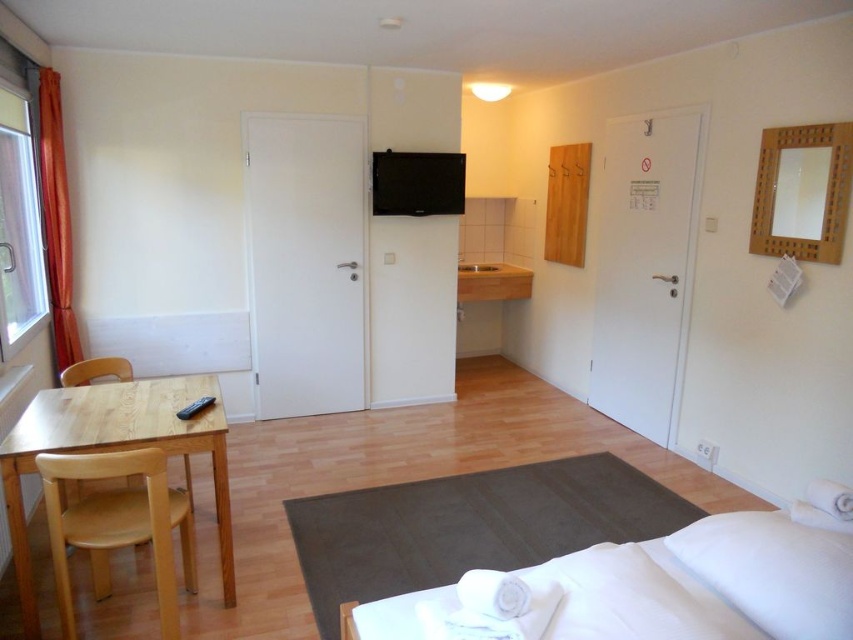
Question: Which point appears closest to the camera in this image?

Choices:
 (A) (213, 461)
 (B) (749, 536)
 (C) (96, 454)
 (D) (482, 84)

Answer: (B)

Question: Considering the real-world distances, which object is closest to the wooden chair at lower left?

Choices:
 (A) white soft pillow at lower right
 (B) light brown wooden table at left
 (C) light brown wooden chair at left

Answer: (B)

Question: Based on their relative distances, which object is nearer to the light brown wooden table at left?

Choices:
 (A) white matte ceiling light at upper center
 (B) light brown wooden chair at left
 (C) dark gray carpet at lower right
 (D) white soft pillow at lower right

Answer: (B)

Question: Does light brown wooden table at left appear on the left side of wooden chair at lower left?

Choices:
 (A) no
 (B) yes

Answer: (A)

Question: Is dark gray carpet at lower right further to camera compared to white soft pillow at lower right?

Choices:
 (A) yes
 (B) no

Answer: (A)

Question: Does dark gray carpet at lower right appear over white soft pillow at lower right?

Choices:
 (A) yes
 (B) no

Answer: (B)